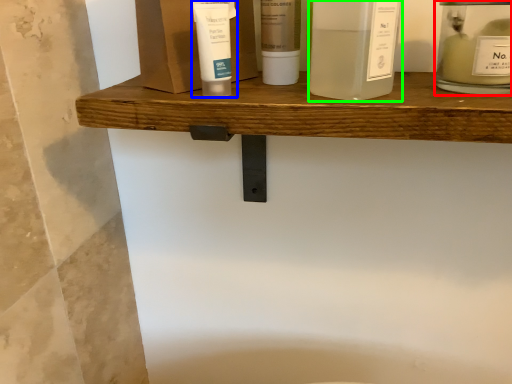
Question: Considering the real-world distances, which object is closest to toiletry (highlighted by a red box)? toiletry (highlighted by a blue box) or product (highlighted by a green box).

Choices:
 (A) toiletry
 (B) product

Answer: (B)